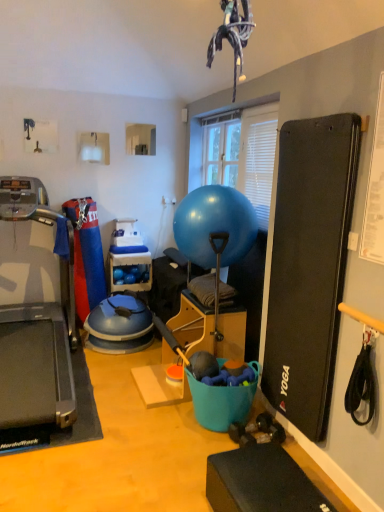
Question: Considering the relative positions of black rubber treadmill at left and glossy rubber ball at center in the image provided, is black rubber treadmill at left behind glossy rubber ball at center?

Choices:
 (A) no
 (B) yes

Answer: (A)

Question: Is black rubber treadmill at left wider than glossy rubber ball at center?

Choices:
 (A) no
 (B) yes

Answer: (B)

Question: Would you say glossy rubber ball at center is part of black rubber treadmill at left's contents?

Choices:
 (A) yes
 (B) no

Answer: (B)

Question: Does black rubber treadmill at left have a larger size compared to glossy rubber ball at center?

Choices:
 (A) yes
 (B) no

Answer: (A)

Question: Considering the relative positions of black rubber treadmill at left and glossy rubber ball at center in the image provided, is black rubber treadmill at left to the left of glossy rubber ball at center from the viewer's perspective?

Choices:
 (A) no
 (B) yes

Answer: (B)

Question: From their relative heights in the image, would you say blue plastic shelf at center is taller or shorter than black rubber treadmill at left?

Choices:
 (A) tall
 (B) short

Answer: (B)

Question: From the image's perspective, is blue plastic shelf at center above or below black rubber treadmill at left?

Choices:
 (A) below
 (B) above

Answer: (A)

Question: From a real-world perspective, is blue plastic shelf at center above or below black rubber treadmill at left?

Choices:
 (A) below
 (B) above

Answer: (A)

Question: Is blue plastic shelf at center to the left or to the right of black rubber treadmill at left in the image?

Choices:
 (A) right
 (B) left

Answer: (A)

Question: Which is correct: glossy rubber ball at center is inside black rubber treadmill at left, or outside of it?

Choices:
 (A) outside
 (B) inside

Answer: (A)

Question: Visually, is glossy rubber ball at center positioned to the left or to the right of black rubber treadmill at left?

Choices:
 (A) right
 (B) left

Answer: (A)

Question: From a real-world perspective, is glossy rubber ball at center above or below black rubber treadmill at left?

Choices:
 (A) below
 (B) above

Answer: (B)

Question: In terms of size, does glossy rubber ball at center appear bigger or smaller than black rubber treadmill at left?

Choices:
 (A) big
 (B) small

Answer: (B)

Question: Is blue plastic shelf at center to the left or to the right of glossy rubber ball at center in the image?

Choices:
 (A) left
 (B) right

Answer: (A)

Question: Does point (145, 253) appear closer or farther from the camera than point (233, 231)?

Choices:
 (A) farther
 (B) closer

Answer: (A)